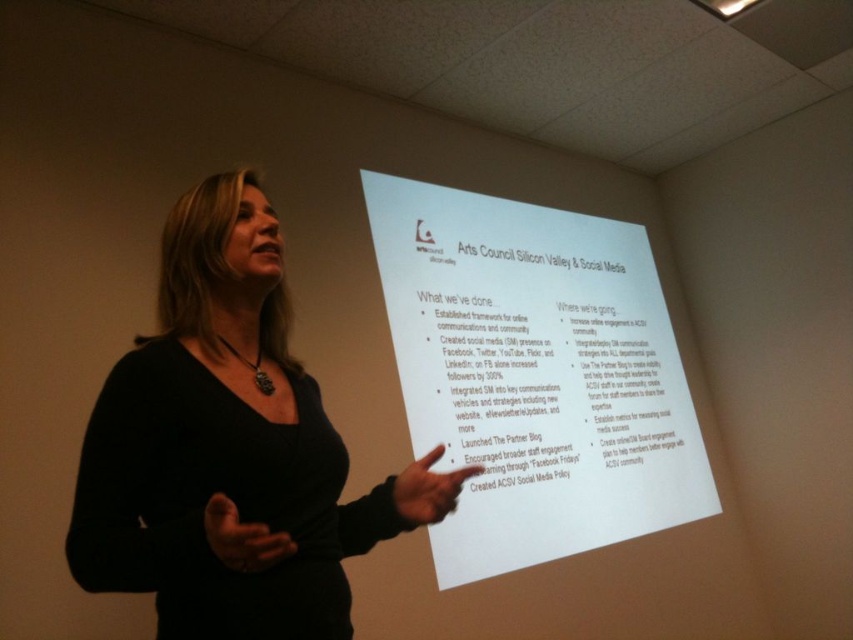
Who is more distant from viewer, (x=561, y=490) or (x=589, y=444)?

Positioned behind is point (x=589, y=444).

Does point (573, 397) come in front of point (432, 285)?

No, (573, 397) is further to viewer.

Is point (422, 360) less distant than point (604, 296)?

Yes, point (422, 360) is closer to viewer.

What are the coordinates of `white paper at center` in the screenshot? It's located at (535, 374).

From the picture: Is black matte dress at center positioned at the back of white paper at upper center?

No, it is in front of white paper at upper center.

Who is more distant from viewer, (97, 483) or (665, 371)?

The point (665, 371) is behind.

This screenshot has width=853, height=640. Find the location of `black matte dress at center`. black matte dress at center is located at coordinates (229, 449).

Consider the image. Is white paper at center bigger than black matte dress at center?

Indeed, white paper at center has a larger size compared to black matte dress at center.

Who is shorter, white paper at center or black matte dress at center?

Standing shorter between the two is black matte dress at center.

Is point (548, 316) farther from camera compared to point (309, 508)?

That is True.

I want to click on white paper at center, so click(535, 374).